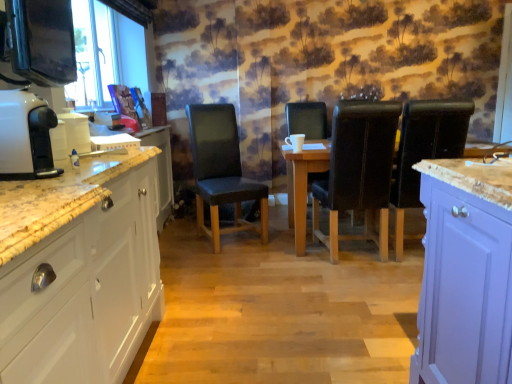
Find the location of a particular element. The image size is (512, 384). vacant area in front of leather at center, which is counted as the second chair, starting from the right is located at coordinates (362, 282).